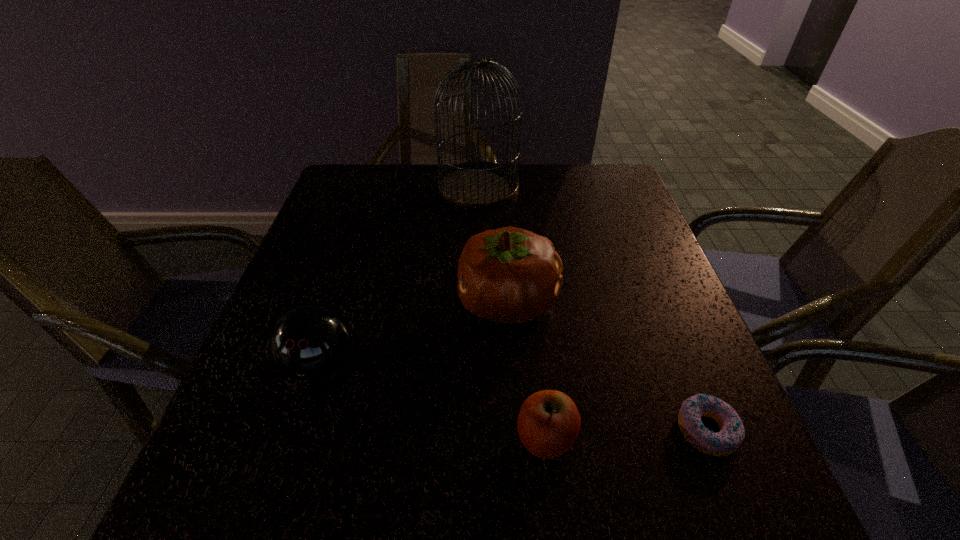
In the image, there is a desktop. What are the coordinates of `vacant space at the near edge` in the screenshot? It's located at click(395, 490).

Where is `free space at the left edge of the desktop`? The width and height of the screenshot is (960, 540). free space at the left edge of the desktop is located at coordinates (325, 211).

The image size is (960, 540). In the image, there is a desktop. What are the coordinates of `vacant space at the right edge` in the screenshot? It's located at (643, 288).

In the image, there is a desktop. Identify the location of vacant space at the far left corner. Image resolution: width=960 pixels, height=540 pixels. (360, 179).

I want to click on free region at the far right corner of the desktop, so click(618, 173).

In the image, there is a desktop. At what (x,y) coordinates should I click in order to perform the action: click on free space at the near right corner. Please return your answer as a coordinate pair (x, y). The width and height of the screenshot is (960, 540). Looking at the image, I should click on (756, 467).

Identify the location of blank region between the apple and the leftmost object. (433, 401).

Locate an element on the screen. vacant space that is in between the tallest object and the rightmost object is located at coordinates (592, 308).

Where is `free space between the birdcage and the leftmost object`? free space between the birdcage and the leftmost object is located at coordinates (399, 275).

At what (x,y) coordinates should I click in order to perform the action: click on vacant space in between the farthest object and the bowling ball. Please return your answer as a coordinate pair (x, y). The height and width of the screenshot is (540, 960). Looking at the image, I should click on (399, 275).